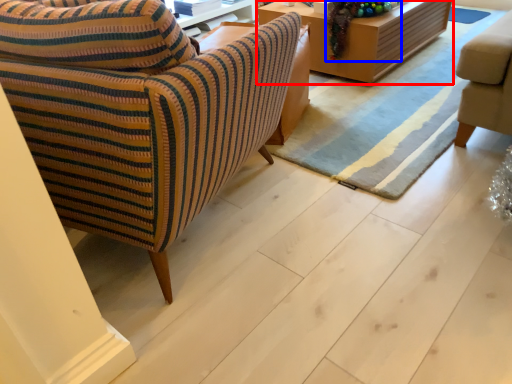
Question: Among these objects, which one is farthest to the camera, table (highlighted by a red box) or christmas decoration (highlighted by a blue box)?

Choices:
 (A) table
 (B) christmas decoration

Answer: (A)